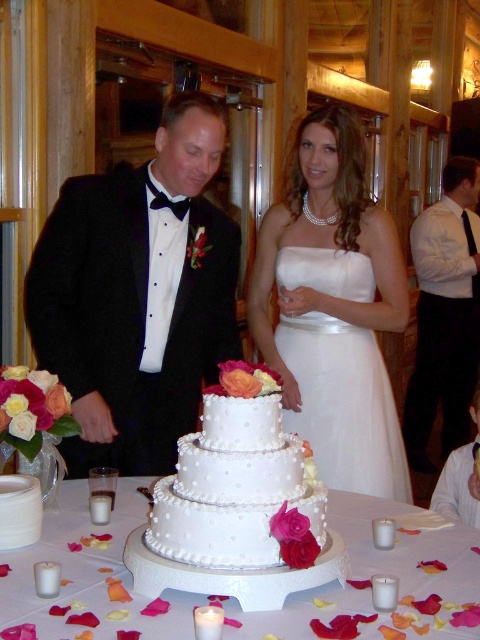
Question: Which point appears closest to the camera in this image?

Choices:
 (A) (289, 572)
 (B) (338, 465)
 (C) (207, 365)

Answer: (A)

Question: Is white satin dress at center further to camera compared to white pearlized cake at center?

Choices:
 (A) yes
 (B) no

Answer: (A)

Question: Which of the following is the farthest from the observer?

Choices:
 (A) (457, 385)
 (B) (78, 593)
 (C) (188, 573)

Answer: (A)

Question: Is black satin tuxedo at center to the right of white satin dress at center from the viewer's perspective?

Choices:
 (A) yes
 (B) no

Answer: (B)

Question: Does white pearlized cake at center appear on the right side of white shirt at right?

Choices:
 (A) yes
 (B) no

Answer: (B)

Question: Which object is farther from the camera taking this photo?

Choices:
 (A) white shirt at right
 (B) white satin dress at center

Answer: (A)